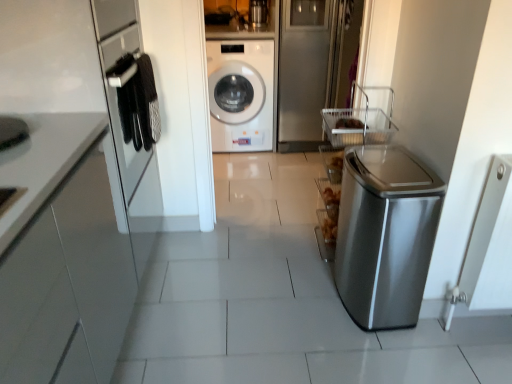
Question: From a real-world perspective, is brushed metal washing machine at upper center physically located above or below clear glass door at upper center?

Choices:
 (A) above
 (B) below

Answer: (A)

Question: Considering their positions, is brushed metal washing machine at upper center located in front of or behind clear glass door at upper center?

Choices:
 (A) behind
 (B) front

Answer: (A)

Question: Estimate the real-world distances between objects in this image. Which object is closer to the satin silver trash can at right?

Choices:
 (A) clear glass door at upper center
 (B) white glossy washing machine at center
 (C) brushed metal washing machine at upper center

Answer: (A)

Question: Which object is positioned farthest from the satin silver trash can at right?

Choices:
 (A) white glossy washing machine at center
 (B) brushed metal washing machine at upper center
 (C) clear glass door at upper center

Answer: (B)